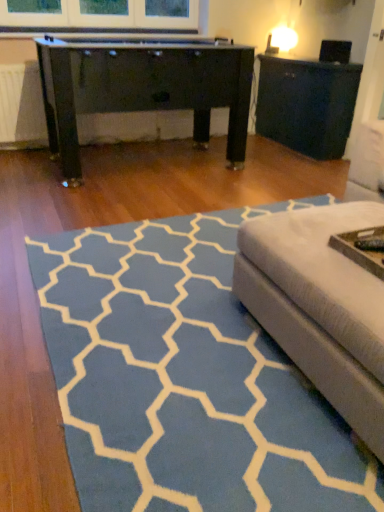
At what (x,y) coordinates should I click in order to perform the action: click on blue soft rug at lower center. Please return your answer as a coordinate pair (x, y). The height and width of the screenshot is (512, 384). Looking at the image, I should click on (185, 378).

The image size is (384, 512). Describe the element at coordinates (185, 378) in the screenshot. I see `blue soft rug at lower center` at that location.

In order to face blue soft rug at lower center, should I rotate leftwards or rightwards?

To face it directly, rotate right by 11.172 degrees.

Locate an element on the screen. Image resolution: width=384 pixels, height=512 pixels. blue soft rug at lower center is located at coordinates (185, 378).